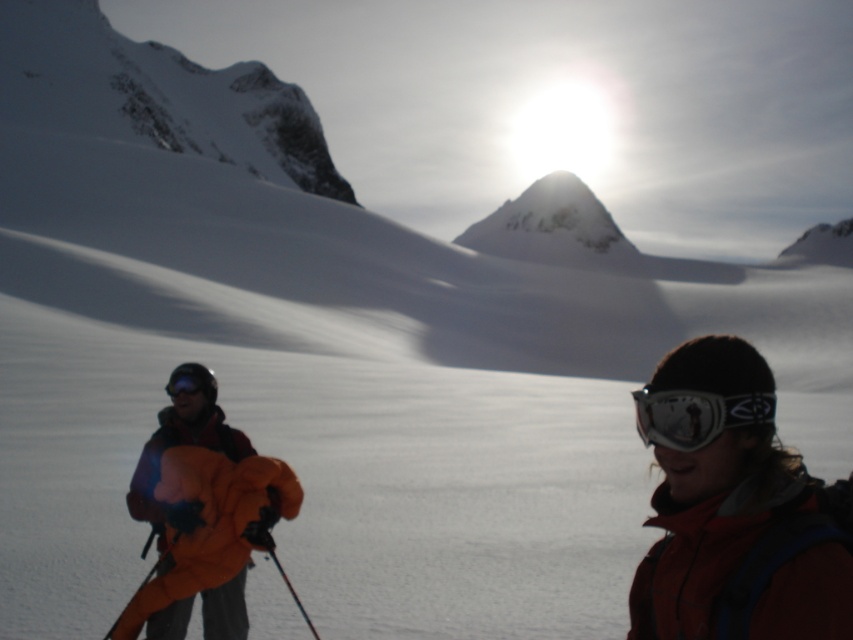
Does white matte goggles at lower right appear over matte black goggles at left?

No, white matte goggles at lower right is not above matte black goggles at left.

Can you confirm if white matte goggles at lower right is smaller than matte black goggles at left?

Incorrect, white matte goggles at lower right is not smaller in size than matte black goggles at left.

Between point (682, 436) and point (195, 387), which one is positioned behind?

Positioned behind is point (195, 387).

This screenshot has width=853, height=640. In order to click on white matte goggles at lower right in this screenshot , I will do `click(695, 416)`.

Does matte orange jacket at lower right appear under white matte goggles at lower right?

Actually, matte orange jacket at lower right is above white matte goggles at lower right.

Does matte orange jacket at lower right have a larger size compared to white matte goggles at lower right?

No, matte orange jacket at lower right is not bigger than white matte goggles at lower right.

Between point (717, 397) and point (636, 394), which one is positioned behind?

The point (636, 394) is behind.

Locate an element on the screen. The height and width of the screenshot is (640, 853). matte orange jacket at lower right is located at coordinates (730, 508).

Is matte orange jacket at lower right closer to camera compared to matte black goggles at left?

Yes, it is.

Describe the element at coordinates (730, 508) in the screenshot. I see `matte orange jacket at lower right` at that location.

Describe the element at coordinates (730, 508) in the screenshot. I see `matte orange jacket at lower right` at that location.

The height and width of the screenshot is (640, 853). What are the coordinates of `matte orange jacket at lower right` in the screenshot? It's located at (730, 508).